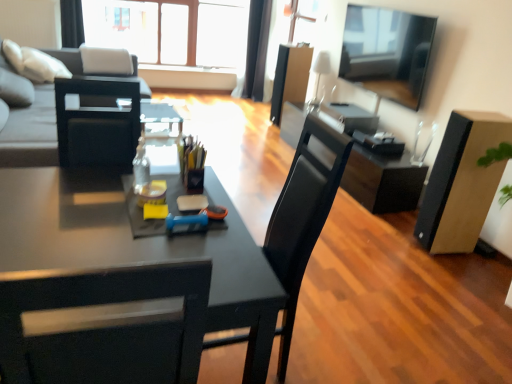
This screenshot has width=512, height=384. I want to click on free point in front of translucent glass bottle at center, so click(122, 207).